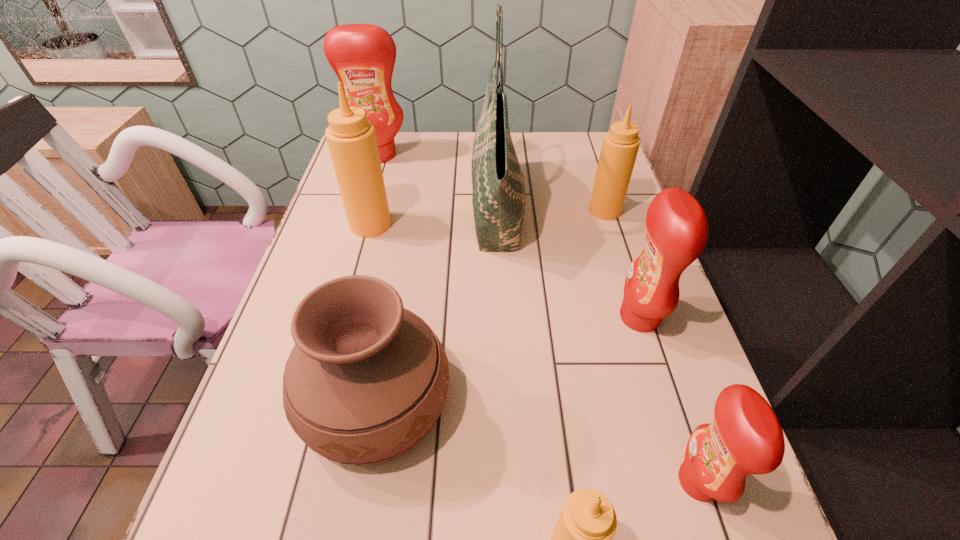
Locate an element on the screen. The image size is (960, 540). free location located 0.140m on the label side of the second nearest condiment is located at coordinates (589, 481).

Find the location of a particular element. The width and height of the screenshot is (960, 540). blank space located 0.250m on the label side of the second nearest condiment is located at coordinates (522, 481).

Locate an element on the screen. tote bag located in the far edge section of the desktop is located at coordinates (498, 199).

I want to click on condiment that is at the far edge, so click(x=363, y=56).

I want to click on urn at the left edge, so click(367, 379).

The width and height of the screenshot is (960, 540). What are the coordinates of `object located in the far left corner section of the desktop` in the screenshot? It's located at click(363, 56).

Find the location of a particular element. Image resolution: width=960 pixels, height=540 pixels. vacant space at the far edge of the desktop is located at coordinates (402, 145).

The width and height of the screenshot is (960, 540). Identify the location of vacant position at the left edge of the desktop. (341, 267).

Find the location of a particular element. This screenshot has width=960, height=540. vacant space at the right edge of the desktop is located at coordinates (669, 347).

You are a GUI agent. You are given a task and a screenshot of the screen. Output one action in this format:
    pyautogui.click(x=<x>, y=<y>)
    Task: Click on the vacant space at the far right corner
    
    Given the screenshot: What is the action you would take?
    pyautogui.click(x=591, y=163)